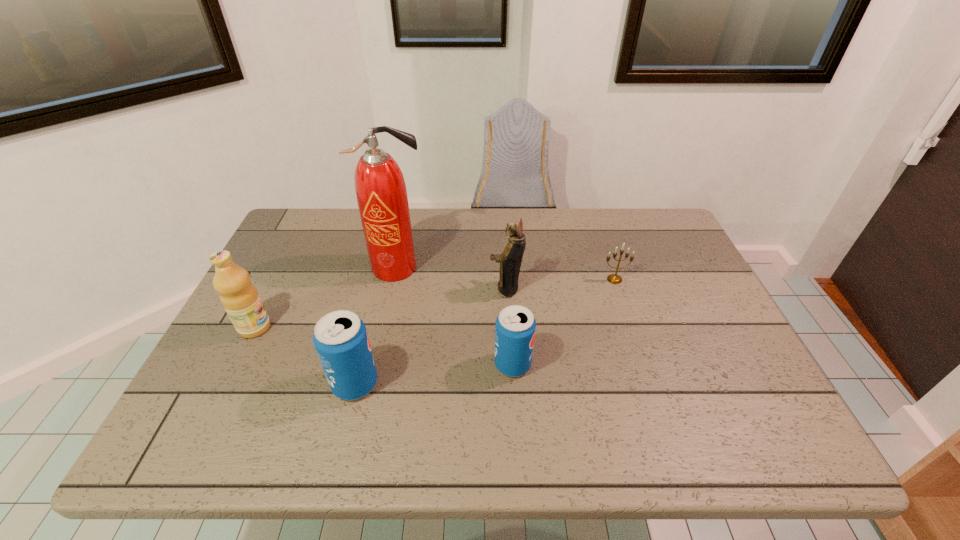
All soda cans are currently evenly spaced. To continue this pattern, where would you add another soda can on the right? Please point out a vacant spot. Please provide its 2D coordinates. Your answer should be formatted as a tuple, i.e. [(x, y)], where the tuple contains the x and y coordinates of a point satisfying the conditions above.

[(659, 346)]